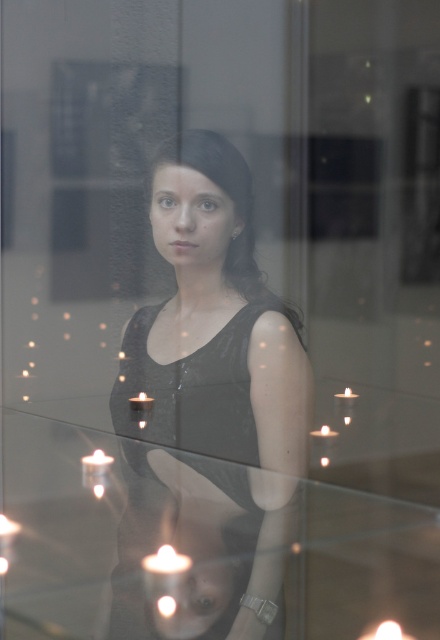
You are a photographer setting up a shoot in this scene. You need to place a new prop between the matte black dress at center and the white wax candle at upper right. Based on their positions, where should you place the prop?

The matte black dress at center is above the white wax candle at upper right, so you should place the prop between them by positioning it below the matte black dress at center and above the white wax candle at upper right.